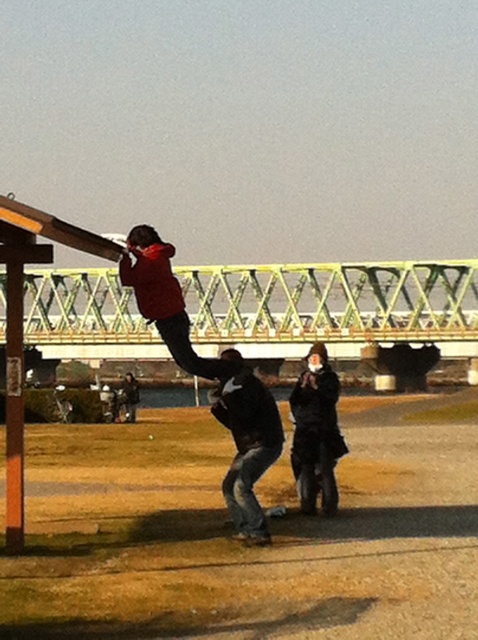
Describe the element at coordinates (247, 444) in the screenshot. I see `dark gray jeans at center` at that location.

Is dark gray jeans at center behind matte red jacket at center?

Yes.

Which is behind, point (237, 481) or point (153, 269)?

Point (237, 481)

Find the location of a particular element. The height and width of the screenshot is (640, 478). dark gray jeans at center is located at coordinates (247, 444).

Is black fur coat at center below matte red jacket at center?

Indeed, black fur coat at center is positioned under matte red jacket at center.

Does black fur coat at center appear on the left side of matte red jacket at center?

No, black fur coat at center is not to the left of matte red jacket at center.

At what (x,y) coordinates should I click in order to perform the action: click on black fur coat at center. Please return your answer as a coordinate pair (x, y). Looking at the image, I should click on (315, 433).

Can you confirm if dark gray jeans at center is positioned above black fur coat at center?

No, dark gray jeans at center is not above black fur coat at center.

Between point (271, 419) and point (318, 460), which one is positioned behind?

The point (318, 460) is more distant.

Is point (236, 452) farther from camera compared to point (314, 410)?

Yes, it is behind point (314, 410).

Where is `dark gray jeans at center`? The height and width of the screenshot is (640, 478). dark gray jeans at center is located at coordinates (247, 444).